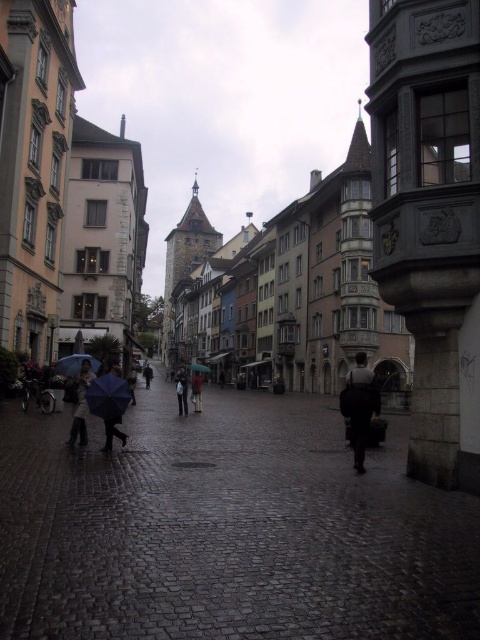
Which is above, dark gray fabric coat at center or dark gray coat at center?

dark gray fabric coat at center is higher up.

Which is below, dark gray fabric coat at center or dark gray coat at center?

dark gray coat at center

At what (x,y) coordinates should I click in order to perform the action: click on dark gray fabric coat at center. Please return your answer as a coordinate pair (x, y). Looking at the image, I should click on (360, 406).

Which of these two, dark cobblestone street at center or matte black umbrella at center, stands shorter?

matte black umbrella at center is shorter.

Who is more forward, (x=64, y=428) or (x=120, y=396)?

Point (x=120, y=396)

The height and width of the screenshot is (640, 480). I want to click on dark cobblestone street at center, so 227,529.

This screenshot has width=480, height=640. What do you see at coordinates (74, 364) in the screenshot?
I see `blue matte umbrella at lower left` at bounding box center [74, 364].

Find the location of a particular element. blue matte umbrella at lower left is located at coordinates (74, 364).